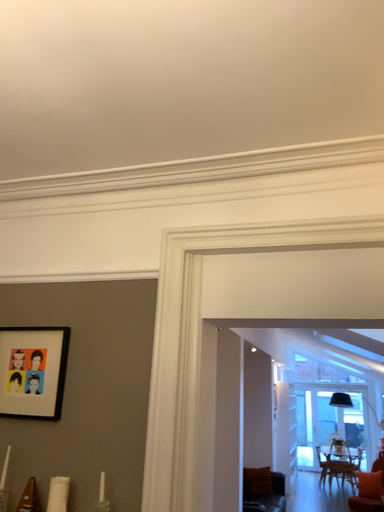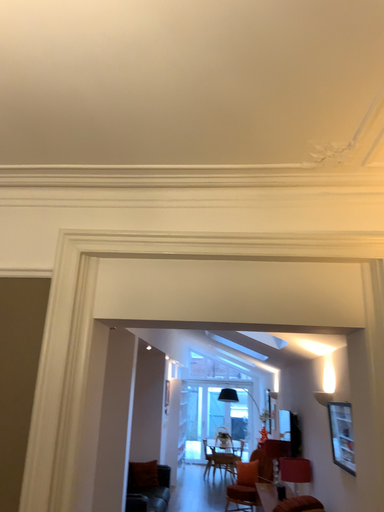
Question: How did the camera likely rotate when shooting the video?

Choices:
 (A) rotated left
 (B) rotated right

Answer: (B)